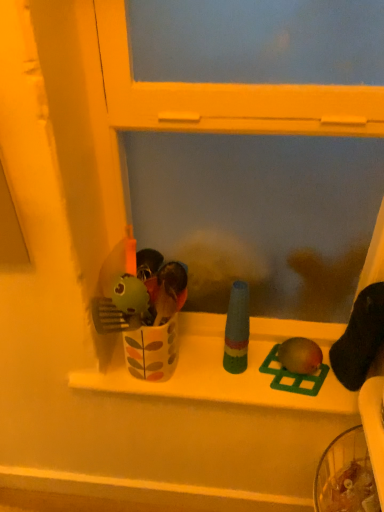
Question: Considering the relative positions of multicolored plastic bottle at center, the 3th toy when ordered from right to left, and white glossy window sill at center in the image provided, is multicolored plastic bottle at center, the 3th toy when ordered from right to left, behind white glossy window sill at center?

Choices:
 (A) no
 (B) yes

Answer: (A)

Question: From the image's perspective, is multicolored plastic bottle at center, the first toy from the left, under white glossy window sill at center?

Choices:
 (A) yes
 (B) no

Answer: (B)

Question: Is multicolored plastic bottle at center, the 3th toy when ordered from right to left, bigger than white glossy window sill at center?

Choices:
 (A) no
 (B) yes

Answer: (A)

Question: Is multicolored plastic bottle at center, the 3th toy when ordered from right to left, positioned before white glossy window sill at center?

Choices:
 (A) no
 (B) yes

Answer: (B)

Question: Is multicolored plastic bottle at center, the first toy from the left, shorter than white glossy window sill at center?

Choices:
 (A) yes
 (B) no

Answer: (B)

Question: Does point (304, 395) appear closer or farther from the camera than point (309, 346)?

Choices:
 (A) farther
 (B) closer

Answer: (B)

Question: In terms of size, does white glossy window sill at center appear bigger or smaller than matte green toy at center, which ranks as the 3th toy in left-to-right order?

Choices:
 (A) small
 (B) big

Answer: (B)

Question: In the image, is white glossy window sill at center positioned in front of or behind matte green toy at center, which ranks as the 3th toy in left-to-right order?

Choices:
 (A) front
 (B) behind

Answer: (A)

Question: Looking at their shapes, would you say white glossy window sill at center is wider or thinner than matte green toy at center, which is counted as the first toy, starting from the right?

Choices:
 (A) wide
 (B) thin

Answer: (A)

Question: Considering the positions of matte green toy at center, which is counted as the first toy, starting from the right, and multicolored plastic bottle at center, the 3th toy when ordered from right to left, in the image, is matte green toy at center, which is counted as the first toy, starting from the right, wider or thinner than multicolored plastic bottle at center, the 3th toy when ordered from right to left,?

Choices:
 (A) thin
 (B) wide

Answer: (B)

Question: From a real-world perspective, is matte green toy at center, which is counted as the first toy, starting from the right, above or below multicolored plastic bottle at center, the 3th toy when ordered from right to left?

Choices:
 (A) above
 (B) below

Answer: (B)

Question: In terms of height, does matte green toy at center, which is counted as the first toy, starting from the right, look taller or shorter compared to multicolored plastic bottle at center, the 3th toy when ordered from right to left?

Choices:
 (A) short
 (B) tall

Answer: (A)

Question: Is matte green toy at center, which ranks as the 3th toy in left-to-right order, to the left or to the right of multicolored plastic bottle at center, the 3th toy when ordered from right to left, in the image?

Choices:
 (A) left
 (B) right

Answer: (B)

Question: Is green plastic bird at center, which is counted as the 2th toy, starting from the right, to the left or to the right of matte green toy at center, which is counted as the first toy, starting from the right, in the image?

Choices:
 (A) left
 (B) right

Answer: (A)

Question: In the image, is green plastic bird at center, which is counted as the 2th toy, starting from the left, positioned in front of or behind matte green toy at center, which is counted as the first toy, starting from the right?

Choices:
 (A) front
 (B) behind

Answer: (B)